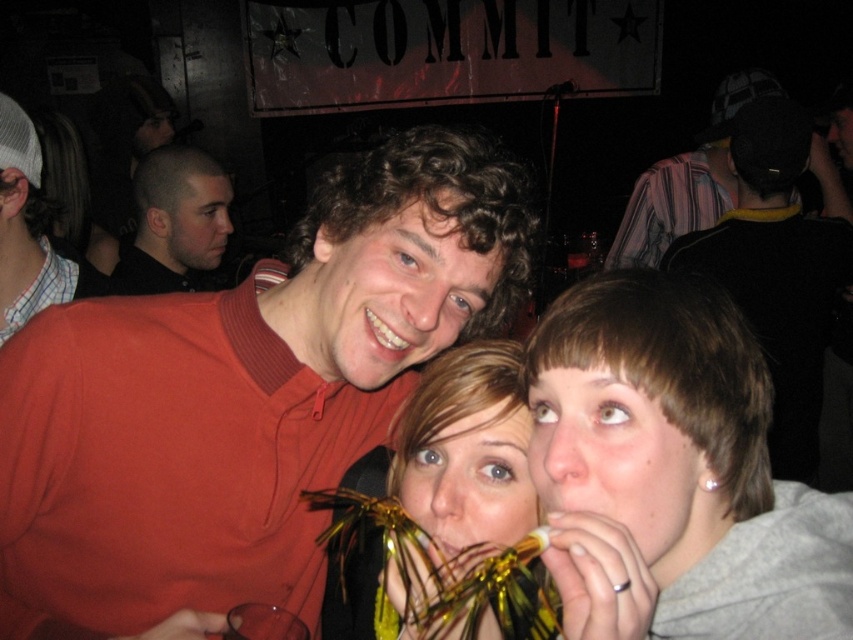
Question: Is black knit cap at upper right smaller than matte red sweater at left?

Choices:
 (A) no
 (B) yes

Answer: (A)

Question: Which point is farther to the camera?

Choices:
 (A) shiny black shirt at left
 (B) matte red sweater at center

Answer: (A)

Question: Observing the image, what is the correct spatial positioning of matte red sweater at center in reference to matte red sweater at left?

Choices:
 (A) left
 (B) right

Answer: (B)

Question: Estimate the real-world distances between objects in this image. Which object is farther from the matte red sweater at center?

Choices:
 (A) shiny gold foil at center
 (B) shiny black shirt at left
 (C) black knit cap at upper right

Answer: (C)

Question: Which point appears farthest from the camera in this image?

Choices:
 (A) pyautogui.click(x=434, y=483)
 (B) pyautogui.click(x=190, y=220)
 (C) pyautogui.click(x=788, y=365)
 (D) pyautogui.click(x=361, y=397)

Answer: (B)

Question: Does shiny gold foil at center have a lesser width compared to striped fabric shirt at upper right?

Choices:
 (A) no
 (B) yes

Answer: (B)